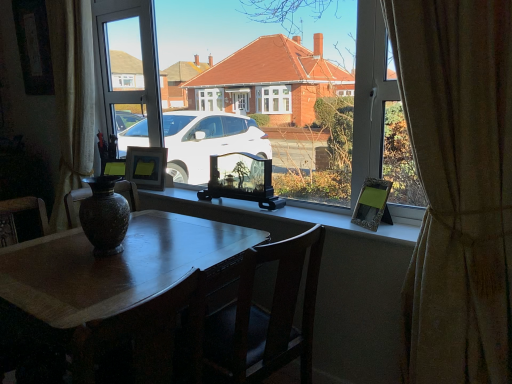
Question: Looking at their shapes, would you say matte black vase at lower left is wider or thinner than marbled stone vase at center?

Choices:
 (A) thin
 (B) wide

Answer: (B)

Question: Is matte black vase at lower left to the left or to the right of marbled stone vase at center in the image?

Choices:
 (A) left
 (B) right

Answer: (A)

Question: Which of these objects is positioned closest to the metallic silver picture frame at right, the 1th picture frame in the right-to-left sequence?

Choices:
 (A) shiny dark wood table at center
 (B) matte black picture frame at center, acting as the third picture frame starting from the front
 (C) translucent glass picture frame at center, placed as the 2th picture frame when sorted from left to right
 (D) beige textured curtain at right
 (E) matte glass photo frame at center

Answer: (E)

Question: Which object is positioned farthest from the translucent glass picture frame at center, positioned as the 2th picture frame in back-to-front order?

Choices:
 (A) marbled stone vase at center
 (B) shiny dark wood table at center
 (C) wooden chair at center
 (D) matte glass photo frame at center
 (E) beige textured curtain at right

Answer: (E)